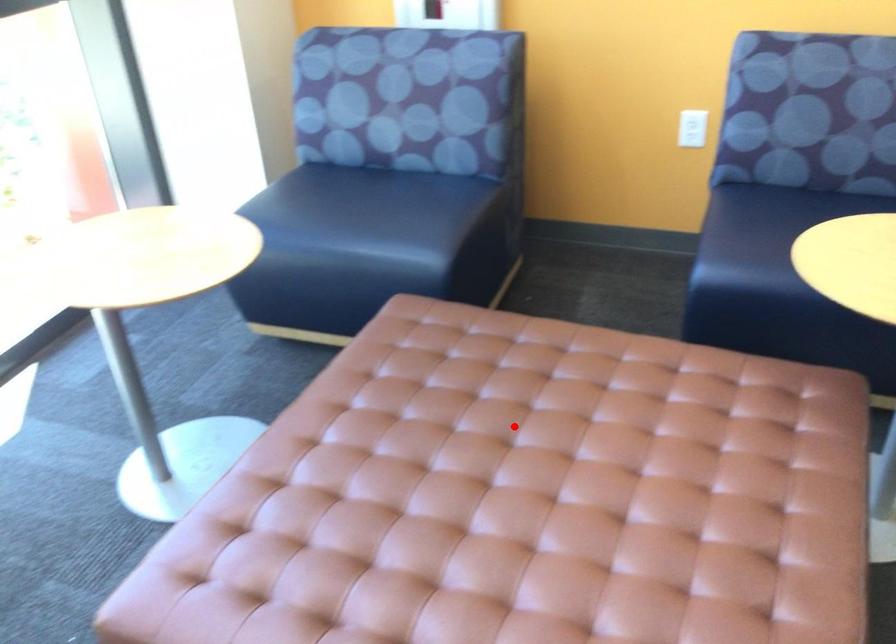
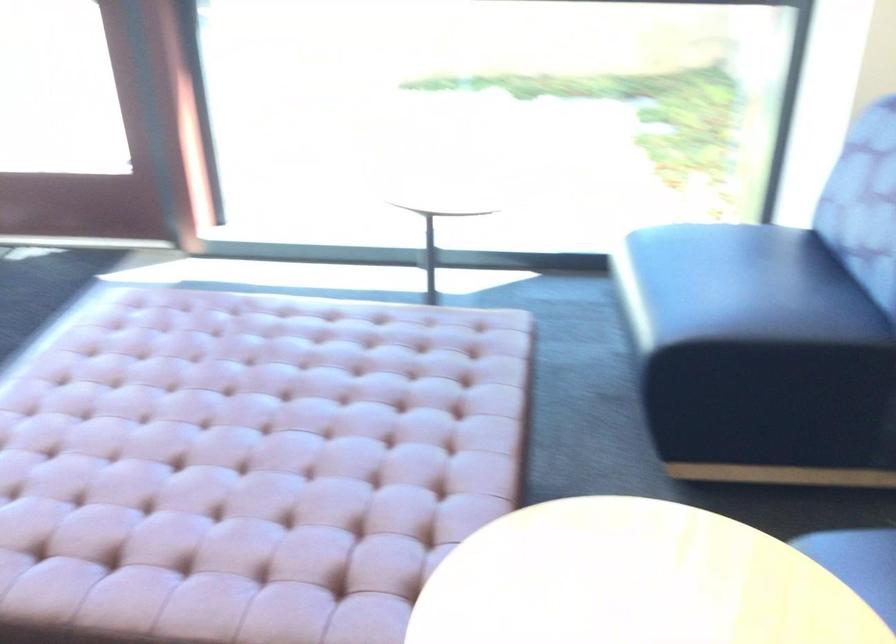
Question: I am providing you with two images of the same scene from different viewpoints. A red point is marked on the first image. At the location where the point appears in image 1, is it still visible in image 2?

Choices:
 (A) Yes
 (B) No

Answer: (A)